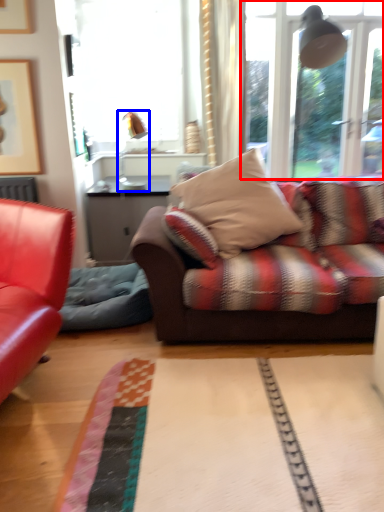
Question: Which object appears closest to the camera in this image, window (highlighted by a red box) or lamp (highlighted by a blue box)?

Choices:
 (A) window
 (B) lamp

Answer: (A)